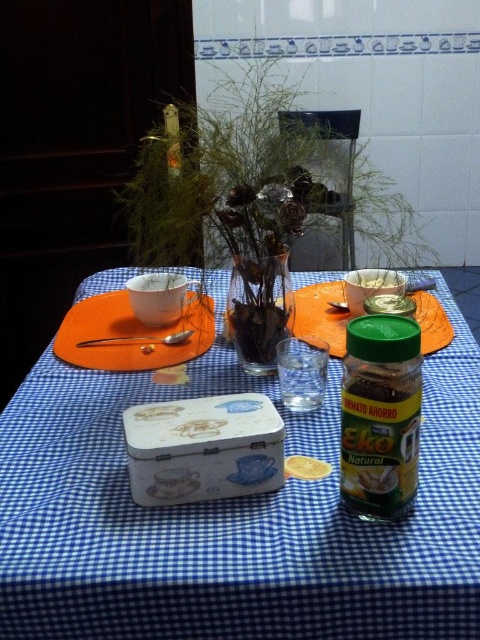
You are setting up a table for a picnic and have the green plastic container at center and the silver spoon at left. Which item is taller?

The green plastic container at center is taller than the silver spoon at left.